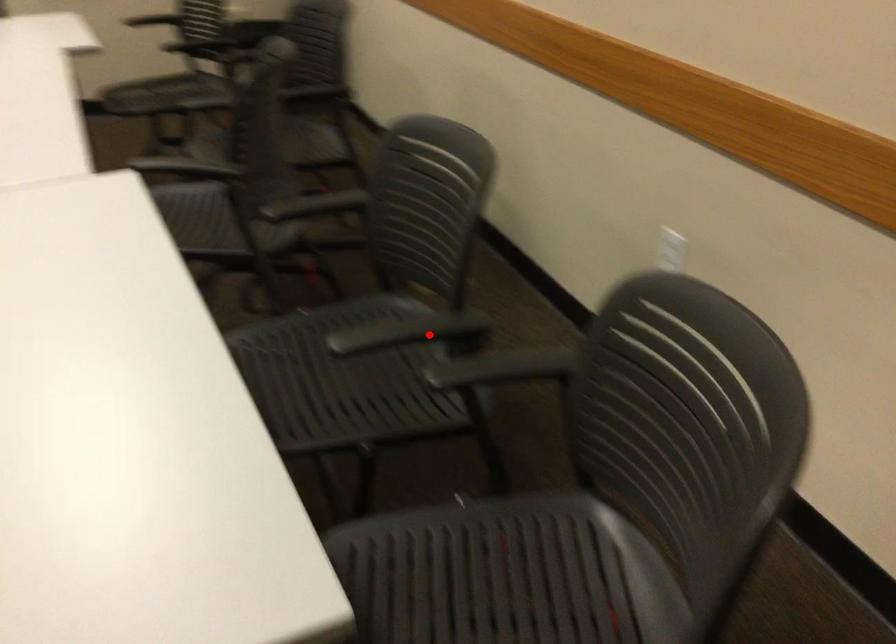
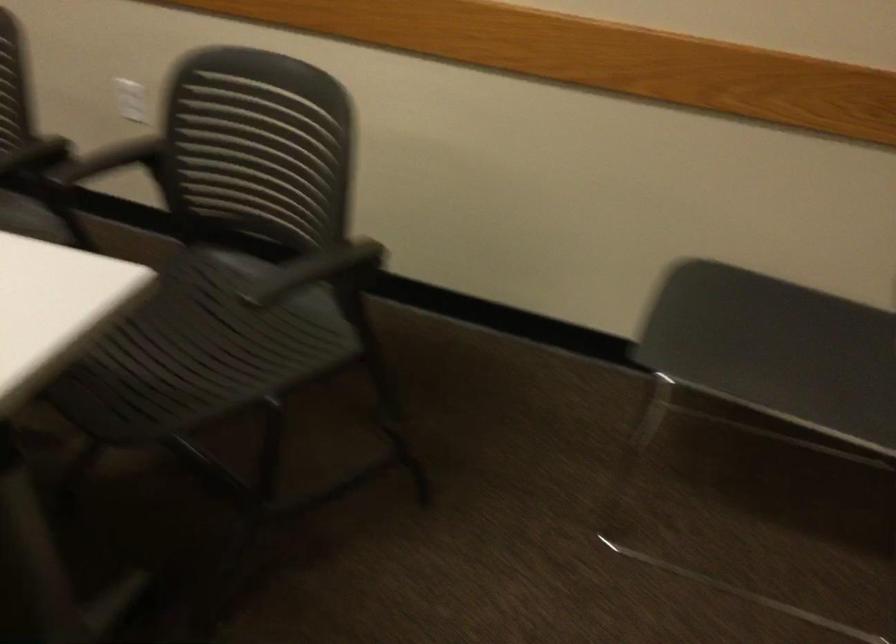
Where in the second image is the point corresponding to the highlighted location from the first image?

(35, 156)